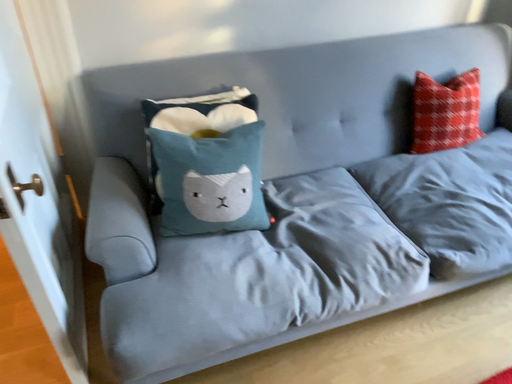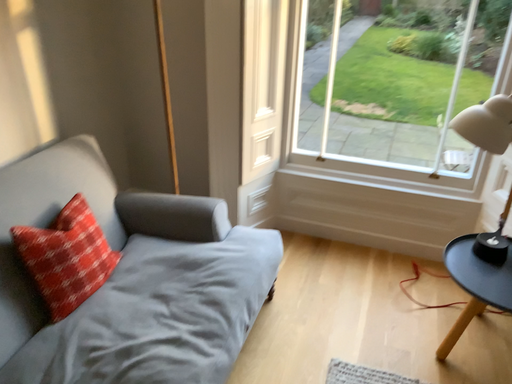
Question: Which way did the camera rotate in the video?

Choices:
 (A) rotated downward
 (B) rotated upward

Answer: (B)